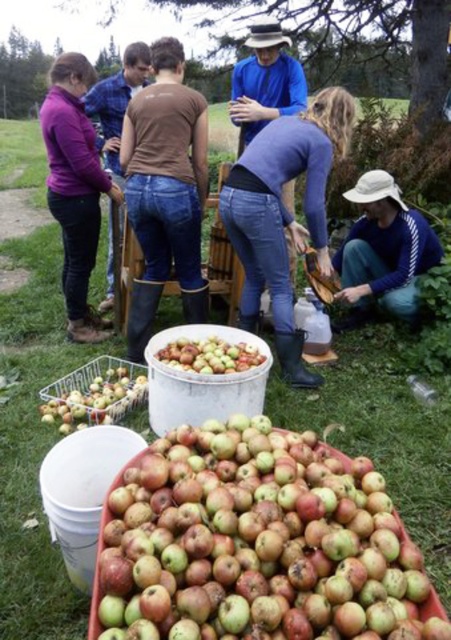
In the scene shown: You are organizing a charity apple donation event and need to determine which item is narrower to fit into a narrow storage space. Based on the scene, which item between the matte purple sweater at left and the white fabric hat at lower right is narrower?

The matte purple sweater at left is narrower than the white fabric hat at lower right, so it would fit better in the narrow storage space.

You are a visitor at an apple orchard and see the rusty metallic apples at lower center and the blue cotton shirt at center. According to the scene, which object is positioned lower in the image?

The rusty metallic apples at lower center is positioned lower than the blue cotton shirt at center in the image.

You are standing in the apple orchard and see the blue jeans at center and the brown matte shirt at center. Which clothing item is more to the right?

The blue jeans at center is positioned on the right side of brown matte shirt at center, so the blue jeans at center is more to the right.